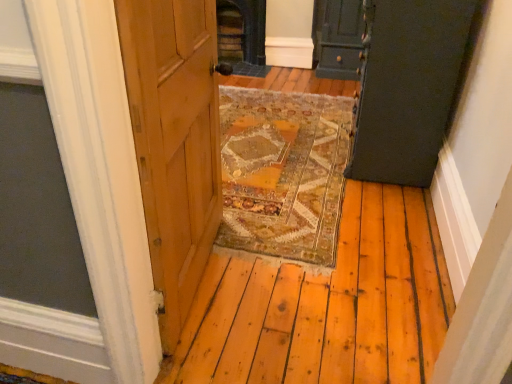
Question: Does dark green wood door at upper right, the 1th door when ordered from back to front, have a lesser height compared to matte dark green cabinet at upper right, marked as the second door in a back-to-front arrangement?

Choices:
 (A) no
 (B) yes

Answer: (B)

Question: Does dark green wood door at upper right, the 1th door when ordered from back to front, have a greater height compared to matte dark green cabinet at upper right, acting as the 1th door starting from the front?

Choices:
 (A) yes
 (B) no

Answer: (B)

Question: Would you say dark green wood door at upper right, the 1th door when ordered from back to front, is outside matte dark green cabinet at upper right, acting as the 1th door starting from the front?

Choices:
 (A) no
 (B) yes

Answer: (B)

Question: Could you tell me if dark green wood door at upper right, acting as the second door starting from the front, is turned towards matte dark green cabinet at upper right, marked as the second door in a back-to-front arrangement?

Choices:
 (A) yes
 (B) no

Answer: (A)

Question: Is dark green wood door at upper right, acting as the second door starting from the front, closer to camera compared to matte dark green cabinet at upper right, marked as the second door in a back-to-front arrangement?

Choices:
 (A) no
 (B) yes

Answer: (A)

Question: From a real-world perspective, is matte dark green cabinet at upper right, marked as the second door in a back-to-front arrangement, physically located above or below dark green wood door at upper right, the 1th door when ordered from back to front?

Choices:
 (A) above
 (B) below

Answer: (A)

Question: In terms of width, does matte dark green cabinet at upper right, marked as the second door in a back-to-front arrangement, look wider or thinner when compared to dark green wood door at upper right, acting as the second door starting from the front?

Choices:
 (A) thin
 (B) wide

Answer: (A)

Question: Do you think matte dark green cabinet at upper right, marked as the second door in a back-to-front arrangement, is within dark green wood door at upper right, the 1th door when ordered from back to front, or outside of it?

Choices:
 (A) inside
 (B) outside

Answer: (B)

Question: Is matte dark green cabinet at upper right, marked as the second door in a back-to-front arrangement, bigger or smaller than dark green wood door at upper right, the 1th door when ordered from back to front?

Choices:
 (A) big
 (B) small

Answer: (A)

Question: Would you say dark gray stone fireplace at center is inside or outside matte dark green cabinet at upper right, marked as the second door in a back-to-front arrangement?

Choices:
 (A) outside
 (B) inside

Answer: (A)

Question: From a real-world perspective, is dark gray stone fireplace at center physically located above or below matte dark green cabinet at upper right, acting as the 1th door starting from the front?

Choices:
 (A) above
 (B) below

Answer: (B)

Question: From their relative heights in the image, would you say dark gray stone fireplace at center is taller or shorter than matte dark green cabinet at upper right, acting as the 1th door starting from the front?

Choices:
 (A) short
 (B) tall

Answer: (A)

Question: Does point (239, 13) appear closer or farther from the camera than point (440, 114)?

Choices:
 (A) farther
 (B) closer

Answer: (A)

Question: Considering the positions of point [x=336, y=1] and point [x=238, y=6], is point [x=336, y=1] closer or farther from the camera than point [x=238, y=6]?

Choices:
 (A) farther
 (B) closer

Answer: (B)

Question: From the image's perspective, is dark green wood door at upper right, the 1th door when ordered from back to front, positioned above or below dark gray stone fireplace at center?

Choices:
 (A) below
 (B) above

Answer: (A)